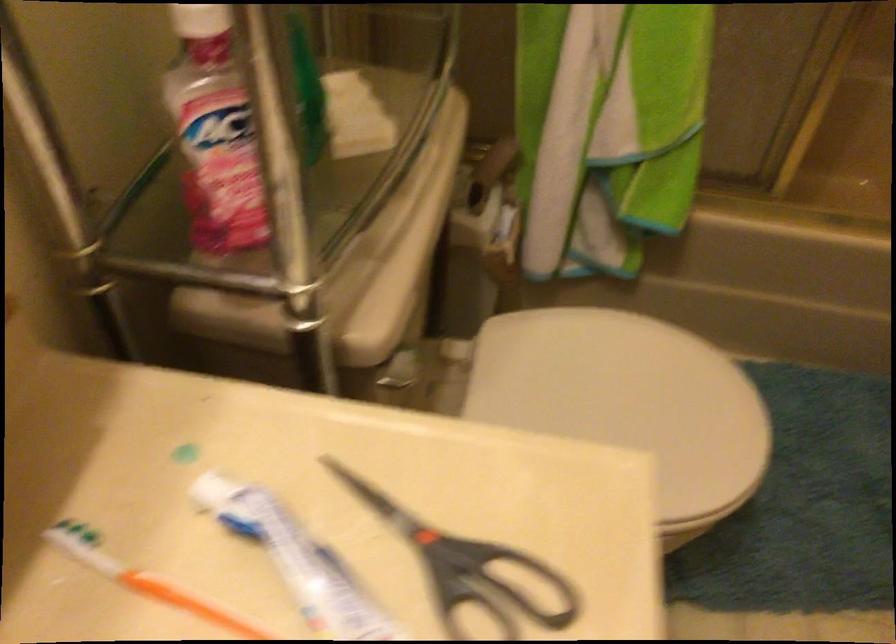
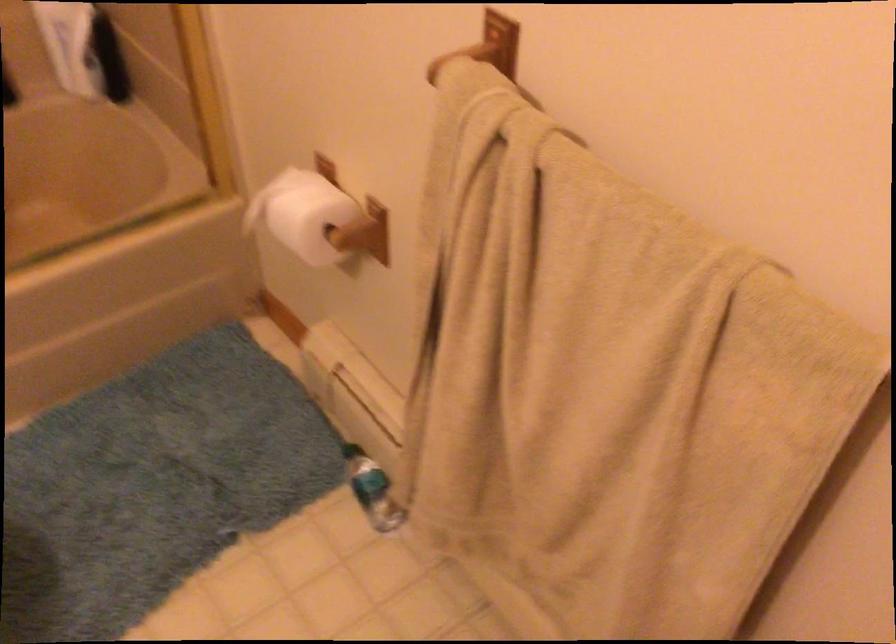
Question: The camera is either moving clockwise (left) or counter-clockwise (right) around the object. The first image is from the beginning of the video and the second image is from the end. Is the camera moving left or right when shooting the video?

Choices:
 (A) Left
 (B) Right

Answer: (A)